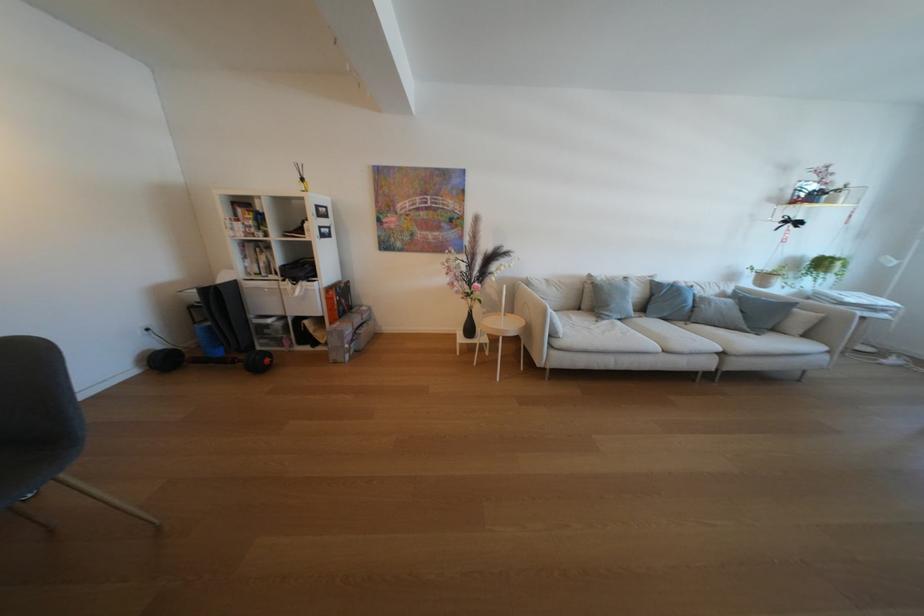
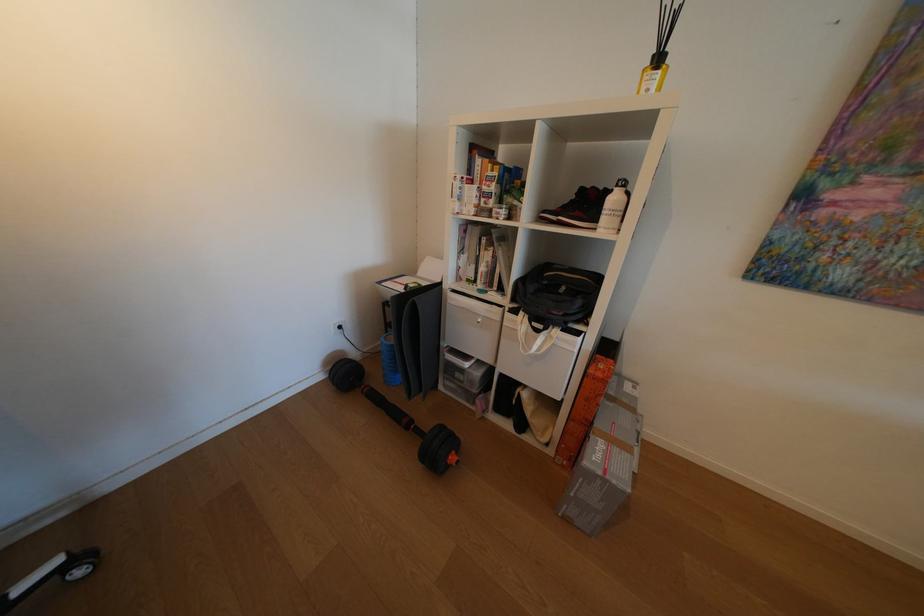
Locate, in the second image, the point that corresponds to point 341,297 in the first image.

(611, 376)